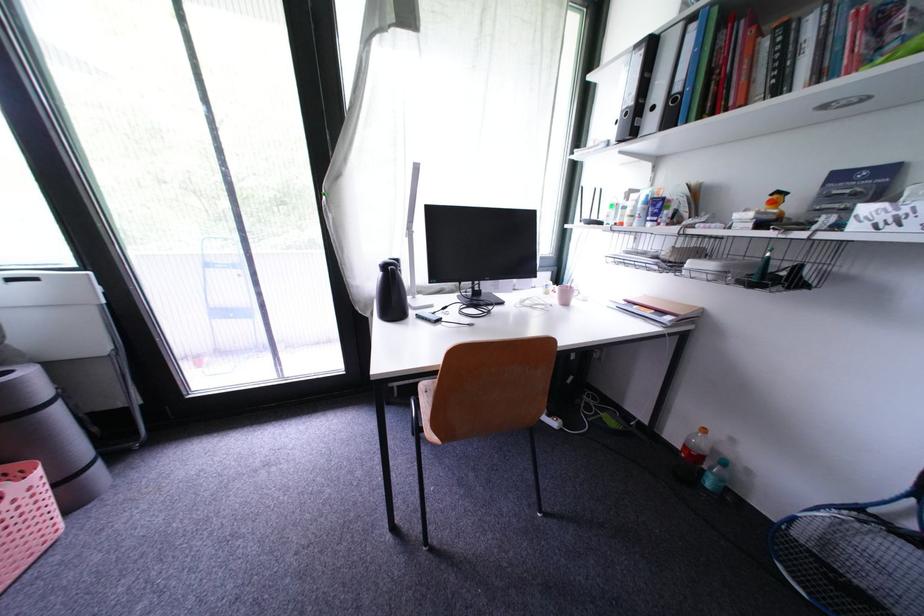
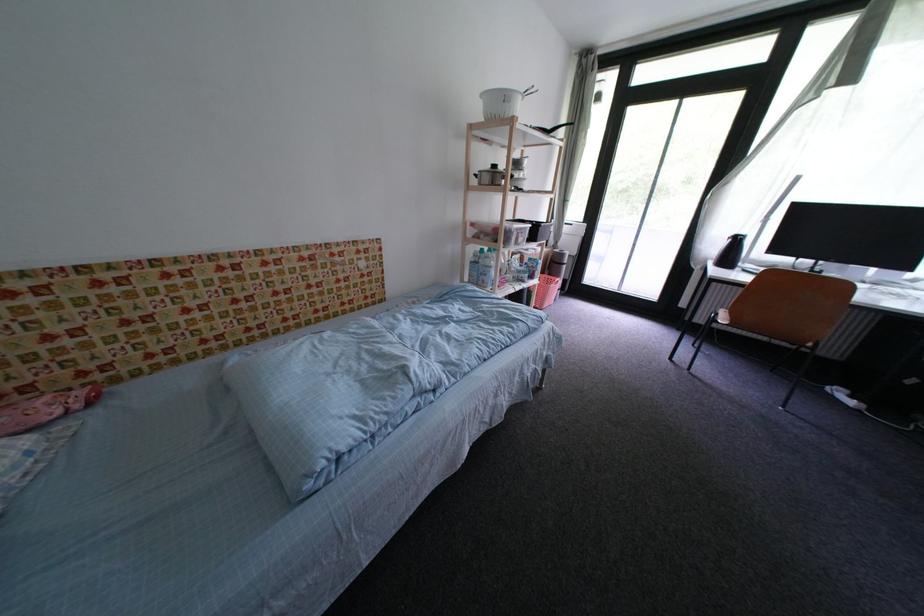
The point at (400, 306) is marked in the first image. Where is the corresponding point in the second image?

(736, 261)